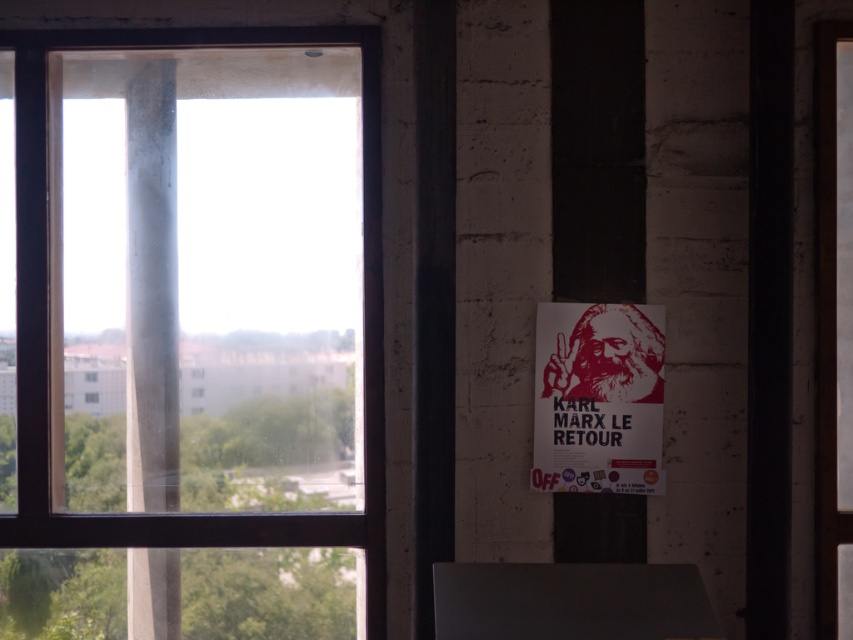
Who is more forward, (149, 627) or (544, 369)?

Point (544, 369) is more forward.

Is gray concrete pillar at center taller than red matte poster at right?

Yes, gray concrete pillar at center is taller than red matte poster at right.

Between point (167, 224) and point (630, 445), which one is positioned behind?

Positioned behind is point (167, 224).

This screenshot has width=853, height=640. In order to click on gray concrete pillar at center in this screenshot , I will do `click(151, 289)`.

Is transparent glass window at left thinner than red matte poster at right?

Incorrect, transparent glass window at left's width is not less than red matte poster at right's.

Is transparent glass window at left smaller than red matte poster at right?

Incorrect, transparent glass window at left is not smaller in size than red matte poster at right.

Where is `transparent glass window at left`? transparent glass window at left is located at coordinates (57, 316).

The image size is (853, 640). Describe the element at coordinates (57, 316) in the screenshot. I see `transparent glass window at left` at that location.

Does point (48, 192) lie in front of point (158, 508)?

Yes, point (48, 192) is in front of point (158, 508).

I want to click on transparent glass window at left, so click(x=57, y=316).